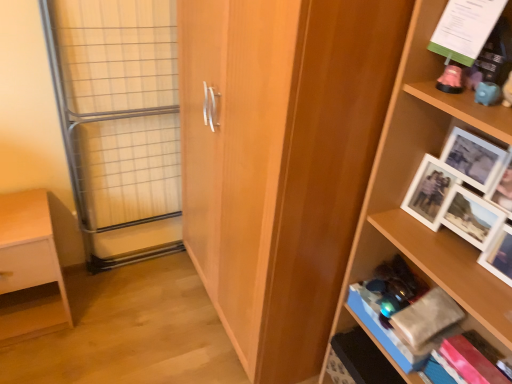
Locate an element on the screen. vacant area that lies between white matte wooden shelf at lower left, acting as the first shelf starting from the left, and clear glass door at left is located at coordinates (114, 291).